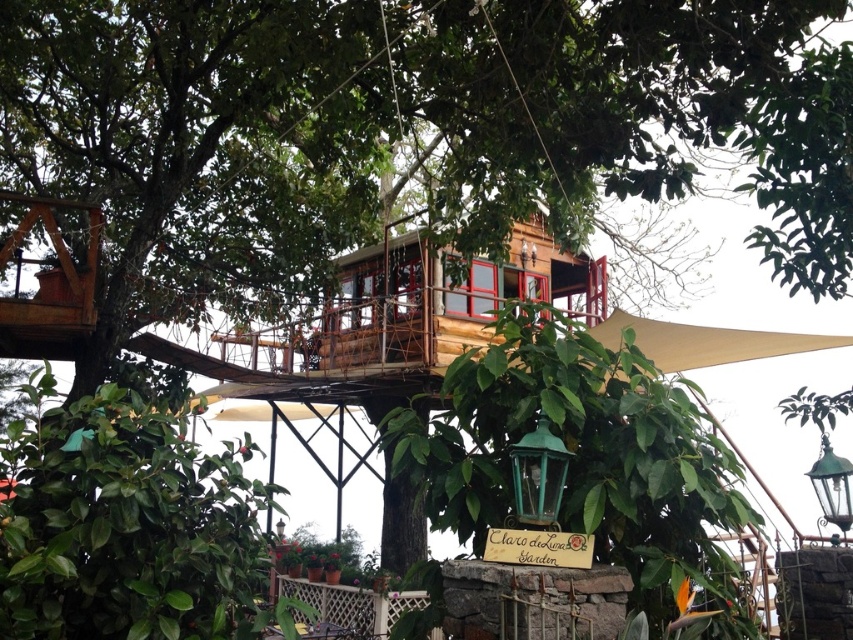
The height and width of the screenshot is (640, 853). What do you see at coordinates (403, 129) in the screenshot?
I see `wooden treehouse at center` at bounding box center [403, 129].

Between point (368, 42) and point (749, 342), which one is positioned behind?

Positioned behind is point (749, 342).

Where is `wooden treehouse at center`? wooden treehouse at center is located at coordinates [403, 129].